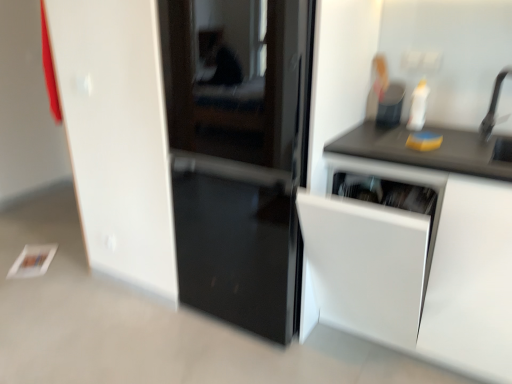
Describe the element at coordinates (240, 174) in the screenshot. I see `glossy black door at center` at that location.

Locate an element on the screen. The width and height of the screenshot is (512, 384). matte black container at upper right is located at coordinates (390, 106).

The width and height of the screenshot is (512, 384). What are the coordinates of `black matte faucet at upper right` in the screenshot? It's located at (494, 106).

You are a GUI agent. You are given a task and a screenshot of the screen. Output one action in this format:
    pyautogui.click(x=<x>, y=<y>)
    Task: Click on the white matte cabinet at right
    
    Given the screenshot: What is the action you would take?
    pyautogui.click(x=451, y=237)

Is black matte countertop at upper right in front of or behind black matte faucet at upper right in the image?

Visually, black matte countertop at upper right is located in front of black matte faucet at upper right.

Is black matte countertop at upper right at the right side of black matte faucet at upper right?

No, black matte countertop at upper right is not to the right of black matte faucet at upper right.

Is black matte countertop at upper right inside or outside of black matte faucet at upper right?

black matte countertop at upper right is located beyond the bounds of black matte faucet at upper right.

Could you tell me if black matte countertop at upper right is turned towards black matte faucet at upper right?

No.

From the picture: Is black matte countertop at upper right positioned with its back to glossy black door at center?

No.

Is black matte countertop at upper right touching glossy black door at center?

No, black matte countertop at upper right is not touching glossy black door at center.

Looking at this image, from a real-world perspective, which object stands above the other?

black matte countertop at upper right is physically above.

Locate an element on the screen. Image resolution: width=512 pixels, height=384 pixels. appliance located above the glossy black door at center (from the image's perspective) is located at coordinates (390, 106).

In terms of size, does matte black container at upper right appear bigger or smaller than glossy black door at center?

Clearly, matte black container at upper right is smaller in size than glossy black door at center.

Between matte black container at upper right and glossy black door at center, which one appears on the right side from the viewer's perspective?

matte black container at upper right.

From a real-world perspective, is matte black container at upper right above or below glossy black door at center?

matte black container at upper right is situated higher than glossy black door at center in the real world.

Can you tell me how much white matte cabinet at right and glossy black door at center differ in facing direction?

There is a 0.00832-degree angle between the facing directions of white matte cabinet at right and glossy black door at center.

Is white matte cabinet at right bigger than glossy black door at center?

Actually, white matte cabinet at right might be smaller than glossy black door at center.

Does point (479, 313) appear closer or farther from the camera than point (269, 184)?

Point (479, 313) is positioned closer to the camera compared to point (269, 184).

Consider the image. Would you say white matte cabinet at right is to the left or to the right of glossy black door at center in the picture?

white matte cabinet at right is to the right of glossy black door at center.

Is white matte cabinet at right wider or thinner than black matte faucet at upper right?

In the image, white matte cabinet at right appears to be wider than black matte faucet at upper right.

What's the angular difference between white matte cabinet at right and black matte faucet at upper right's facing directions?

The angle between the facing direction of white matte cabinet at right and the facing direction of black matte faucet at upper right is 0.288 degrees.

Where is `faucet behind the white matte cabinet at right`? This screenshot has height=384, width=512. faucet behind the white matte cabinet at right is located at coordinates (494, 106).

Is point (429, 300) closer or farther from the camera than point (484, 138)?

Clearly, point (429, 300) is closer to the camera than point (484, 138).

Is black matte countertop at upper right thinner than matte black container at upper right?

In fact, black matte countertop at upper right might be wider than matte black container at upper right.

Does black matte countertop at upper right have a smaller size compared to matte black container at upper right?

Actually, black matte countertop at upper right might be larger than matte black container at upper right.

From a real-world perspective, which object rests below the other?

black matte countertop at upper right is physically lower.

I want to click on cabinetry behind the glossy black door at center, so click(x=451, y=237).

Is glossy black door at center aimed at white matte cabinet at right?

No, glossy black door at center is not facing towards white matte cabinet at right.

Are glossy black door at center and white matte cabinet at right located far from each other?

Actually, glossy black door at center and white matte cabinet at right are a little close together.

The height and width of the screenshot is (384, 512). In order to click on faucet behind the black matte countertop at upper right in this screenshot , I will do `click(494, 106)`.

Find the location of a particular element. door lying on the left of black matte countertop at upper right is located at coordinates (x=240, y=174).

Estimate the real-world distances between objects in this image. Which object is closer to black matte countertop at upper right, glossy black door at center or matte black container at upper right?

Among the two, matte black container at upper right is located nearer to black matte countertop at upper right.

Based on the photo, from the image, which object appears to be farther from glossy black door at center, black matte faucet at upper right or matte black container at upper right?

black matte faucet at upper right.

Considering their positions, is matte black container at upper right positioned closer to black matte faucet at upper right than white matte cabinet at right?

matte black container at upper right is positioned closer to the anchor black matte faucet at upper right.

Based on their spatial positions, is white matte cabinet at right or black matte countertop at upper right closer to black matte faucet at upper right?

black matte countertop at upper right is closer to black matte faucet at upper right.

Considering their positions, is black matte countertop at upper right positioned closer to black matte faucet at upper right than matte black container at upper right?

Based on the image, black matte countertop at upper right appears to be nearer to black matte faucet at upper right.

Considering their positions, is matte black container at upper right positioned closer to white matte cabinet at right than black matte countertop at upper right?

Based on the image, black matte countertop at upper right appears to be nearer to white matte cabinet at right.

Considering their positions, is black matte countertop at upper right positioned closer to white matte cabinet at right than black matte faucet at upper right?

black matte countertop at upper right is positioned closer to the anchor white matte cabinet at right.

From the image, which object appears to be nearer to black matte countertop at upper right, black matte faucet at upper right or white matte cabinet at right?

white matte cabinet at right is positioned closer to the anchor black matte countertop at upper right.

Locate an element on the screen. This screenshot has height=384, width=512. countertop situated between glossy black door at center and black matte faucet at upper right from left to right is located at coordinates (430, 151).

Locate an element on the screen. This screenshot has height=384, width=512. cabinetry situated between glossy black door at center and black matte countertop at upper right from left to right is located at coordinates (451, 237).

Where is `faucet between matte black container at upper right and white matte cabinet at right from top to bottom`? faucet between matte black container at upper right and white matte cabinet at right from top to bottom is located at coordinates (494, 106).

At what (x,y) coordinates should I click in order to perform the action: click on cabinetry positioned between glossy black door at center and matte black container at upper right from near to far. Please return your answer as a coordinate pair (x, y). Looking at the image, I should click on (451, 237).